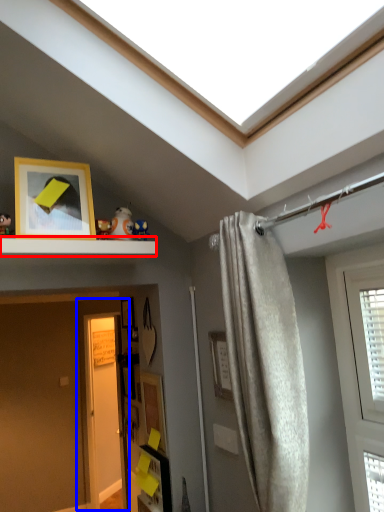
Question: Which point is further to the camera, shelf (highlighted by a red box) or door (highlighted by a blue box)?

Choices:
 (A) shelf
 (B) door

Answer: (B)